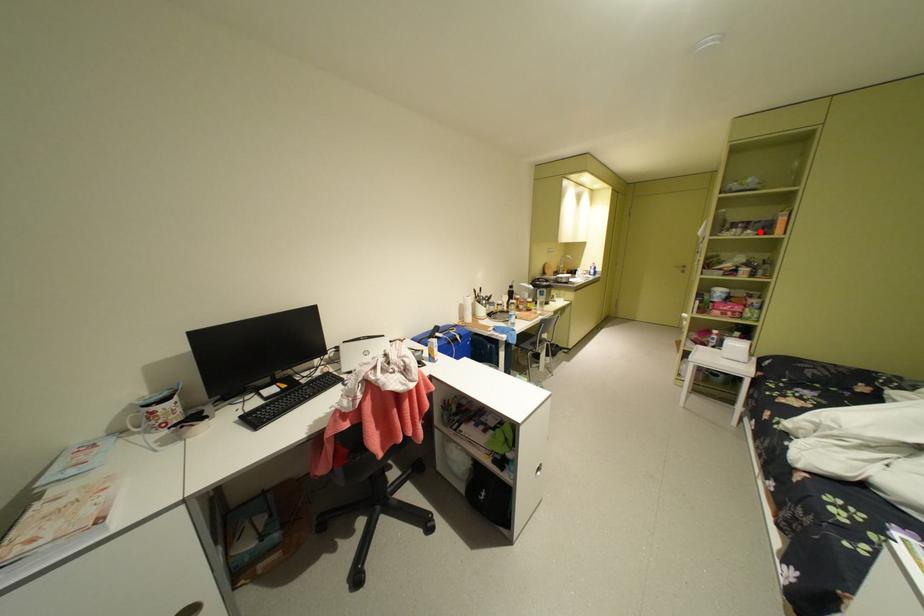
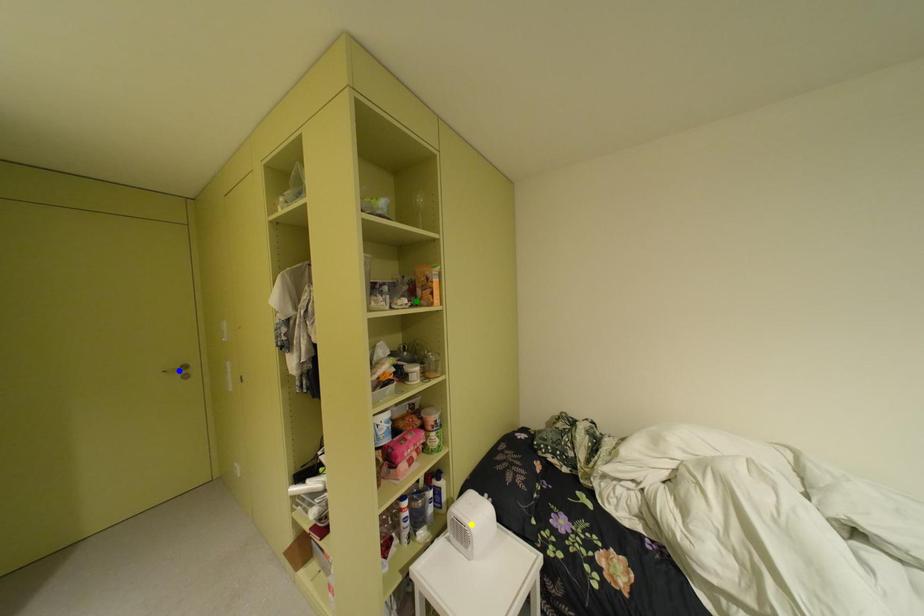
Question: I am providing you with two images of the same scene from different viewpoints. A red point is marked on the first image. You are given multiple points on the second image. Which point in image 2 is actually the same real-world point as the red point in image 1?

Choices:
 (A) yellow point
 (B) green point
 (C) blue point

Answer: (B)